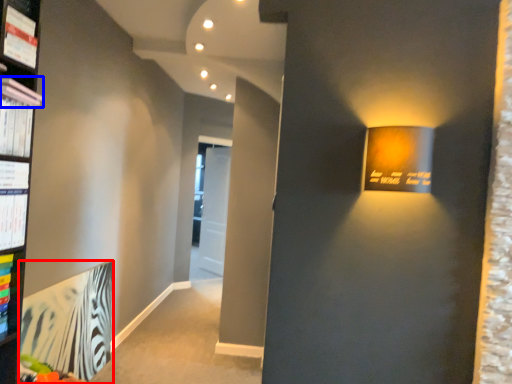
Question: Among these objects, which one is nearest to the camera, paperback book (highlighted by a red box) or book (highlighted by a blue box)?

Choices:
 (A) paperback book
 (B) book

Answer: (B)